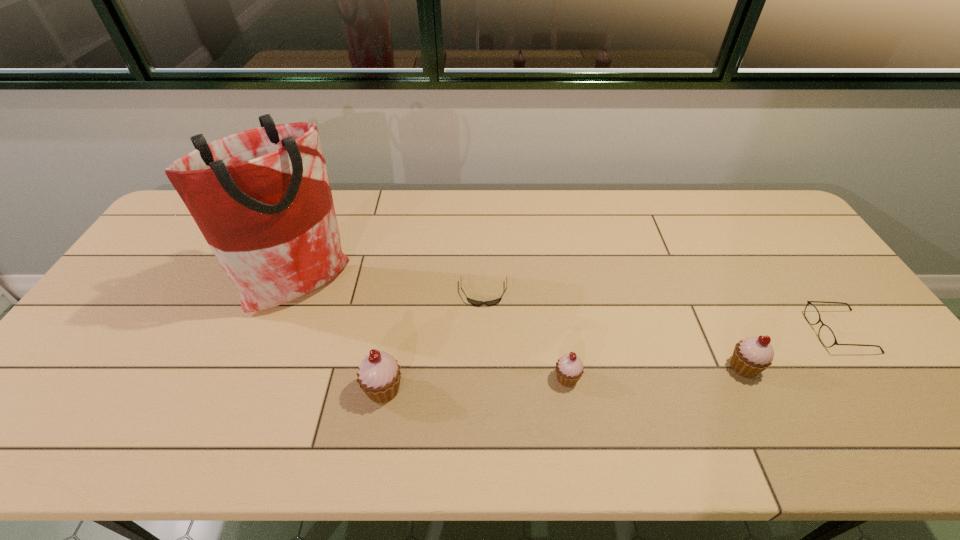
With all cupcakes evenly spaced, where should an extra cupcake be placed on the left to continue the pattern? Please point out a vacant space. Please provide its 2D coordinates. Your answer should be formatted as a tuple, i.e. [(x, y)], where the tuple contains the x and y coordinates of a point satisfying the conditions above.

[(192, 401)]